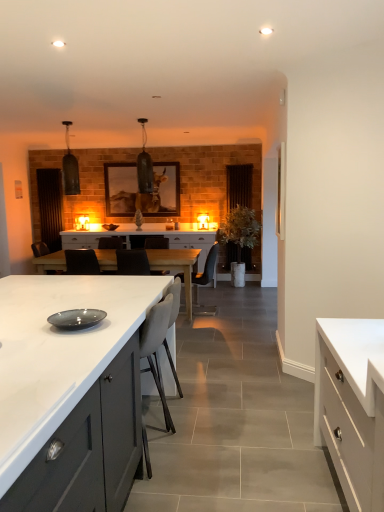
The width and height of the screenshot is (384, 512). What are the coordinates of `beige fabric armchair at center, marked as the second armchair in a back-to-front arrangement` in the screenshot? It's located at (170, 346).

Image resolution: width=384 pixels, height=512 pixels. What do you see at coordinates (170, 346) in the screenshot?
I see `beige fabric armchair at center, marked as the second armchair in a back-to-front arrangement` at bounding box center [170, 346].

Where is `white glossy cabinet at center, which appears as the 3th cabinetry when viewed from the front`? white glossy cabinet at center, which appears as the 3th cabinetry when viewed from the front is located at coordinates (194, 243).

Identify the location of brown wooden door at left, the 1th glass door in the left-to-right sequence. The height and width of the screenshot is (512, 384). (50, 207).

Image resolution: width=384 pixels, height=512 pixels. Identify the location of beige fabric armchair at center, marked as the second armchair in a back-to-front arrangement. (170, 346).

Can you confirm if white matte cabinet at center, which is the third cabinetry from back to front, is smaller than transparent glass door at center, which is the 2th glass door in left-to-right order?

Incorrect, white matte cabinet at center, which is the third cabinetry from back to front, is not smaller in size than transparent glass door at center, which is the 2th glass door in left-to-right order.

Is white matte cabinet at center, which is the third cabinetry from back to front, positioned far away from transparent glass door at center, which is the 2th glass door in left-to-right order?

Yes, white matte cabinet at center, which is the third cabinetry from back to front, is far from transparent glass door at center, which is the 2th glass door in left-to-right order.

Between point (131, 362) and point (226, 167), which one is positioned in front?

Point (131, 362)

From the image's perspective, which object appears higher, white matte cabinet at center, which is the third cabinetry from back to front, or transparent glass door at center, which is the 2th glass door in left-to-right order?

transparent glass door at center, which is the 2th glass door in left-to-right order, is shown above in the image.

Is transparent glass door at center, which appears as the first glass door when viewed from the right, in front of or behind white matte cabinet at center, the 1th cabinetry when ordered from front to back, in the image?

Visually, transparent glass door at center, which appears as the first glass door when viewed from the right, is located behind white matte cabinet at center, the 1th cabinetry when ordered from front to back.

Is point (233, 208) less distant than point (58, 432)?

No.

Can you confirm if transparent glass door at center, which is the 2th glass door in left-to-right order, is smaller than white matte cabinet at center, the 1th cabinetry when ordered from front to back?

Indeed, transparent glass door at center, which is the 2th glass door in left-to-right order, has a smaller size compared to white matte cabinet at center, the 1th cabinetry when ordered from front to back.

The width and height of the screenshot is (384, 512). Identify the location of cabinetry that appears above the leather armchair at center, acting as the first armchair starting from the back (from a real-world perspective). (194, 243).

Based on the photo, considering the sizes of objects white glossy cabinet at center, marked as the 2th cabinetry in a left-to-right arrangement, and leather armchair at center, positioned as the 2th armchair in front-to-back order, in the image provided, who is thinner, white glossy cabinet at center, marked as the 2th cabinetry in a left-to-right arrangement, or leather armchair at center, positioned as the 2th armchair in front-to-back order,?

leather armchair at center, positioned as the 2th armchair in front-to-back order.

Which is behind, point (214, 241) or point (198, 303)?

The point (214, 241) is more distant.

Is point (58, 173) positioned behind point (166, 340)?

That is True.

Is brown wooden door at left, acting as the 2th glass door starting from the right, turned away from beige fabric armchair at center, marked as the 1th armchair in a front-to-back arrangement?

No.

Looking at their sizes, would you say brown wooden door at left, acting as the 2th glass door starting from the right, is wider or thinner than beige fabric armchair at center, marked as the second armchair in a back-to-front arrangement?

In the image, brown wooden door at left, acting as the 2th glass door starting from the right, appears to be more narrow than beige fabric armchair at center, marked as the second armchair in a back-to-front arrangement.

Between brown wooden door at left, the 1th glass door in the left-to-right sequence, and beige fabric armchair at center, marked as the second armchair in a back-to-front arrangement, which one has more height?

brown wooden door at left, the 1th glass door in the left-to-right sequence.

Considering the sizes of objects beige fabric armchair at center, marked as the second armchair in a back-to-front arrangement, and white matte cabinet at right, the 2th cabinetry from the front, in the image provided, who is taller, beige fabric armchair at center, marked as the second armchair in a back-to-front arrangement, or white matte cabinet at right, the 2th cabinetry from the front,?

With more height is beige fabric armchair at center, marked as the second armchair in a back-to-front arrangement.

Considering the positions of objects beige fabric armchair at center, marked as the second armchair in a back-to-front arrangement, and white matte cabinet at right, the 2th cabinetry from the front, in the image provided, who is more to the right, beige fabric armchair at center, marked as the second armchair in a back-to-front arrangement, or white matte cabinet at right, the 2th cabinetry from the front,?

white matte cabinet at right, the 2th cabinetry from the front, is more to the right.

Is beige fabric armchair at center, marked as the 1th armchair in a front-to-back arrangement, positioned with its back to white matte cabinet at right, the 2th cabinetry positioned from the back?

No, beige fabric armchair at center, marked as the 1th armchair in a front-to-back arrangement, is not facing away from white matte cabinet at right, the 2th cabinetry positioned from the back.

Can you confirm if beige fabric armchair at center, marked as the second armchair in a back-to-front arrangement, is thinner than white matte cabinet at right, positioned as the 1th cabinetry in right-to-left order?

Yes, beige fabric armchair at center, marked as the second armchair in a back-to-front arrangement, is thinner than white matte cabinet at right, positioned as the 1th cabinetry in right-to-left order.

Is beige fabric armchair at center, marked as the second armchair in a back-to-front arrangement, oriented towards leather armchair at center, positioned as the 2th armchair in front-to-back order?

No, beige fabric armchair at center, marked as the second armchair in a back-to-front arrangement, does not turn towards leather armchair at center, positioned as the 2th armchair in front-to-back order.

Which is closer, (146, 379) or (207, 306)?

Point (146, 379) appears to be closer to the viewer than point (207, 306).

In the image, there is a beige fabric armchair at center, marked as the second armchair in a back-to-front arrangement. In order to click on armchair above it (from the image's perspective) in this screenshot , I will do `click(206, 281)`.

Measure the distance from beige fabric armchair at center, marked as the 1th armchair in a front-to-back arrangement, to leather armchair at center, acting as the first armchair starting from the back.

They are 11.61 feet apart.

Is white glossy cabinet at center, which appears as the 3th cabinetry when viewed from the front, facing towards brown wooden door at left, acting as the 2th glass door starting from the right?

No.

From the image's perspective, count 2nd glass doors upward from the white glossy cabinet at center, marked as the 2th cabinetry in a left-to-right arrangement, and point to it. Please provide its 2D coordinates.

[(50, 207)]

What's the angular difference between white glossy cabinet at center, which appears as the 3th cabinetry when viewed from the front, and brown wooden door at left, acting as the 2th glass door starting from the right,'s facing directions?

0.000124 degrees separate the facing orientations of white glossy cabinet at center, which appears as the 3th cabinetry when viewed from the front, and brown wooden door at left, acting as the 2th glass door starting from the right.

Does white glossy cabinet at center, marked as the 2th cabinetry in a left-to-right arrangement, have a lesser width compared to brown wooden door at left, acting as the 2th glass door starting from the right?

No.

Identify the location of glass door that is on the right side of white matte cabinet at center, the 1th cabinetry when ordered from front to back. This screenshot has height=512, width=384. pyautogui.click(x=239, y=185).

Starting from the transparent glass door at center, which is the 2th glass door in left-to-right order, which cabinetry is the 3rd one in front? Please provide its 2D coordinates.

[(90, 448)]

Based on their spatial positions, is matte gray plate at center or brown wooden door at left, the 1th glass door in the left-to-right sequence, closer to white matte cabinet at right, positioned as the 1th cabinetry in right-to-left order?

matte gray plate at center is positioned closer to the anchor white matte cabinet at right, positioned as the 1th cabinetry in right-to-left order.

Considering their positions, is brown wooden door at left, the 1th glass door in the left-to-right sequence, positioned closer to leather armchair at center, positioned as the 2th armchair in front-to-back order, than beige fabric armchair at center, marked as the 1th armchair in a front-to-back arrangement?

The object closer to leather armchair at center, positioned as the 2th armchair in front-to-back order, is brown wooden door at left, the 1th glass door in the left-to-right sequence.

Looking at the image, which one is located closer to white glossy table at center, beige fabric armchair at center, marked as the 1th armchair in a front-to-back arrangement, or leather armchair at center, acting as the first armchair starting from the back?

leather armchair at center, acting as the first armchair starting from the back, is closer to white glossy table at center.

Estimate the real-world distances between objects in this image. Which object is closer to transparent glass door at center, which appears as the first glass door when viewed from the right, white matte cabinet at right, positioned as the 1th cabinetry in right-to-left order, or beige fabric armchair at center, marked as the 1th armchair in a front-to-back arrangement?

beige fabric armchair at center, marked as the 1th armchair in a front-to-back arrangement, is positioned closer to the anchor transparent glass door at center, which appears as the first glass door when viewed from the right.

Estimate the real-world distances between objects in this image. Which object is further from white glossy table at center, beige fabric armchair at center, marked as the 1th armchair in a front-to-back arrangement, or white matte cabinet at center, arranged as the third cabinetry when viewed from the right?

Based on the image, white matte cabinet at center, arranged as the third cabinetry when viewed from the right, appears to be further to white glossy table at center.

Looking at the image, which one is located closer to beige fabric armchair at center, marked as the second armchair in a back-to-front arrangement, white matte cabinet at right, positioned as the 1th cabinetry in right-to-left order, or transparent glass door at center, which appears as the first glass door when viewed from the right?

white matte cabinet at right, positioned as the 1th cabinetry in right-to-left order.

From the image, which object appears to be nearer to transparent glass door at center, which is the 2th glass door in left-to-right order, leather armchair at center, acting as the first armchair starting from the back, or white matte cabinet at right, which is the 3th cabinetry from left to right?

The object closer to transparent glass door at center, which is the 2th glass door in left-to-right order, is leather armchair at center, acting as the first armchair starting from the back.

In the scene shown: Estimate the real-world distances between objects in this image. Which object is further from white glossy cabinet at center, marked as the 2th cabinetry in a left-to-right arrangement, leather armchair at center, acting as the first armchair starting from the back, or beige fabric armchair at center, marked as the second armchair in a back-to-front arrangement?

beige fabric armchair at center, marked as the second armchair in a back-to-front arrangement, is further to white glossy cabinet at center, marked as the 2th cabinetry in a left-to-right arrangement.

Locate an element on the screen. This screenshot has width=384, height=512. table positioned between white matte cabinet at right, positioned as the 1th cabinetry in right-to-left order, and transparent glass door at center, which appears as the first glass door when viewed from the right, from near to far is located at coordinates (177, 267).

You are a GUI agent. You are given a task and a screenshot of the screen. Output one action in this format:
    pyautogui.click(x=<x>, y=<y>)
    Task: Click on the plate between white matte cabinet at center, arranged as the third cabinetry when viewed from the right, and white glossy table at center in the front-back direction
    This screenshot has height=512, width=384.
    Given the screenshot: What is the action you would take?
    pyautogui.click(x=76, y=319)

Image resolution: width=384 pixels, height=512 pixels. I want to click on cabinetry located between white matte cabinet at right, which is the 3th cabinetry from left to right, and transparent glass door at center, which is the 2th glass door in left-to-right order, in the depth direction, so point(194,243).

Identify the location of table positioned between matte gray plate at center and brown wooden door at left, acting as the 2th glass door starting from the right, from near to far. (177, 267).